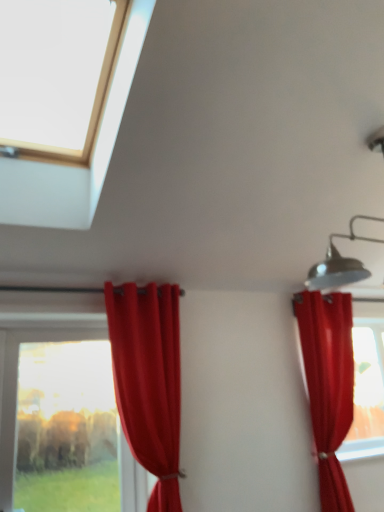
Question: Considering the relative sizes of satin red curtain at right, the second curtain when ordered from left to right, and transparent glass window at lower left, which is the 2th window from top to bottom, in the image provided, is satin red curtain at right, the second curtain when ordered from left to right, shorter than transparent glass window at lower left, which is the 2th window from top to bottom,?

Choices:
 (A) no
 (B) yes

Answer: (A)

Question: From a real-world perspective, is satin red curtain at right, which appears as the first curtain when viewed from the right, physically above transparent glass window at lower left, placed as the first window when sorted from back to front?

Choices:
 (A) yes
 (B) no

Answer: (A)

Question: Is satin red curtain at right, the second curtain when ordered from left to right, not near transparent glass window at lower left, the 1th window from the bottom?

Choices:
 (A) no
 (B) yes

Answer: (B)

Question: Is the position of satin red curtain at right, which appears as the first curtain when viewed from the right, less distant than that of transparent glass window at lower left, marked as the 2th window in a front-to-back arrangement?

Choices:
 (A) no
 (B) yes

Answer: (A)

Question: Can you confirm if satin red curtain at right, which appears as the first curtain when viewed from the right, is bigger than transparent glass window at lower left, placed as the first window when sorted from back to front?

Choices:
 (A) yes
 (B) no

Answer: (A)

Question: Is satin red curtain at right, the second curtain when ordered from left to right, bigger or smaller than transparent glass window at upper left, which appears as the first window when viewed from the top?

Choices:
 (A) big
 (B) small

Answer: (A)

Question: From a real-world perspective, is satin red curtain at right, the second curtain when ordered from left to right, above or below transparent glass window at upper left, which appears as the first window when viewed from the top?

Choices:
 (A) below
 (B) above

Answer: (A)

Question: Is satin red curtain at right, which appears as the first curtain when viewed from the right, spatially inside transparent glass window at upper left, which appears as the first window when viewed from the top, or outside of it?

Choices:
 (A) outside
 (B) inside

Answer: (A)

Question: Is satin red curtain at right, which appears as the first curtain when viewed from the right, taller or shorter than transparent glass window at upper left, arranged as the 1th window when viewed from the front?

Choices:
 (A) tall
 (B) short

Answer: (A)

Question: Is transparent glass window at upper left, arranged as the 1th window when viewed from the front, in front of or behind satin red curtain at right, which appears as the first curtain when viewed from the right, in the image?

Choices:
 (A) front
 (B) behind

Answer: (A)

Question: From the image's perspective, relative to satin red curtain at right, the second curtain when ordered from left to right, is transparent glass window at upper left, which appears as the first window when viewed from the top, above or below?

Choices:
 (A) above
 (B) below

Answer: (A)

Question: In terms of width, does transparent glass window at upper left, which appears as the first window when viewed from the top, look wider or thinner when compared to satin red curtain at right, which appears as the first curtain when viewed from the right?

Choices:
 (A) thin
 (B) wide

Answer: (B)

Question: Choose the correct answer: Is transparent glass window at upper left, arranged as the 1th window when viewed from the front, inside satin red curtain at right, which appears as the first curtain when viewed from the right, or outside it?

Choices:
 (A) outside
 (B) inside

Answer: (A)

Question: Which is correct: transparent glass window at upper left, the 2th window when ordered from bottom to top, is inside velvet red curtain at left, which appears as the 2th curtain when viewed from the right, or outside of it?

Choices:
 (A) outside
 (B) inside

Answer: (A)

Question: Looking at their shapes, would you say transparent glass window at upper left, which is the 2th window from back to front, is wider or thinner than velvet red curtain at left, which appears as the 2th curtain when viewed from the right?

Choices:
 (A) wide
 (B) thin

Answer: (A)